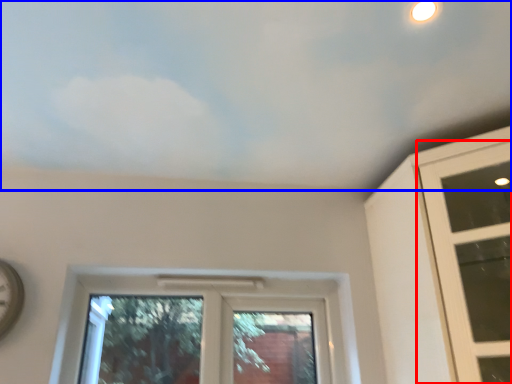
Question: Which point is closer to the camera, window (highlighted by a red box) or cloud (highlighted by a blue box)?

Choices:
 (A) window
 (B) cloud

Answer: (B)